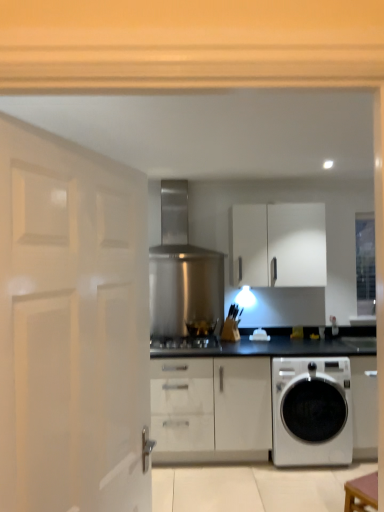
Image resolution: width=384 pixels, height=512 pixels. I want to click on white glossy washing machine at lower right, so pos(312,411).

Describe the element at coordinates (365, 263) in the screenshot. Image resolution: width=384 pixels, height=512 pixels. I see `transparent glass door at upper right` at that location.

What are the coordinates of `transparent glass door at upper right` in the screenshot? It's located at (365, 263).

This screenshot has height=512, width=384. What do you see at coordinates (361, 493) in the screenshot?
I see `brown wooden table at lower right` at bounding box center [361, 493].

Image resolution: width=384 pixels, height=512 pixels. What do you see at coordinates (176, 219) in the screenshot?
I see `stainless steel exhaust hood at center` at bounding box center [176, 219].

Locate an element on the screen. The image size is (384, 512). white glossy door at left is located at coordinates (71, 327).

In order to click on white glossy washing machine at lower right in this screenshot , I will do `click(312, 411)`.

Considering the relative sizes of white glossy door at left and brown wooden table at lower right in the image provided, is white glossy door at left thinner than brown wooden table at lower right?

Correct, the width of white glossy door at left is less than that of brown wooden table at lower right.

From a real-world perspective, between white glossy door at left and brown wooden table at lower right, who is vertically lower?

From a 3D spatial view, brown wooden table at lower right is below.

Is white glossy door at left with brown wooden table at lower right?

No, white glossy door at left is not beside brown wooden table at lower right.

Consider the image. How different are the orientations of white glossy door at left and brown wooden table at lower right in degrees?

white glossy door at left and brown wooden table at lower right are facing 48.1 degrees away from each other.

Is black glass stove at center aimed at stainless steel exhaust hood at center?

No, black glass stove at center is not turned towards stainless steel exhaust hood at center.

In the scene shown: Which is more to the right, black glass stove at center or stainless steel exhaust hood at center?

From the viewer's perspective, black glass stove at center appears more on the right side.

From a real-world perspective, is black glass stove at center physically located above or below stainless steel exhaust hood at center?

Clearly, from a real-world perspective, black glass stove at center is below stainless steel exhaust hood at center.

Looking at this image, would you say black glass stove at center is inside or outside stainless steel exhaust hood at center?

black glass stove at center lies outside stainless steel exhaust hood at center.

From their relative heights in the image, would you say satin silver gas stove at center is taller or shorter than white glossy washing machine at lower right?

Clearly, satin silver gas stove at center is shorter compared to white glossy washing machine at lower right.

Are satin silver gas stove at center and white glossy washing machine at lower right far apart?

No, satin silver gas stove at center is not far away from white glossy washing machine at lower right.

From the image's perspective, between satin silver gas stove at center and white glossy washing machine at lower right, which one is located above?

satin silver gas stove at center, from the image's perspective.

Which object is closer to the camera taking this photo, stainless steel exhaust hood at center or satin silver gas stove at center?

satin silver gas stove at center is more forward.

How many degrees apart are the facing directions of stainless steel exhaust hood at center and satin silver gas stove at center?

There is a 0.0435-degree angle between the facing directions of stainless steel exhaust hood at center and satin silver gas stove at center.

Between point (166, 196) and point (207, 345), which one is positioned behind?

The point (166, 196) is more distant.

Does stainless steel exhaust hood at center turn towards satin silver gas stove at center?

No, stainless steel exhaust hood at center is not facing towards satin silver gas stove at center.

Are white glossy washing machine at lower right and white matte cabinet at upper center located far from each other?

Indeed, white glossy washing machine at lower right is not near white matte cabinet at upper center.

Between white glossy washing machine at lower right and white matte cabinet at upper center, which one has larger size?

Bigger between the two is white glossy washing machine at lower right.

Is point (318, 390) positioned before point (299, 246)?

No.

Who is shorter, white glossy washing machine at lower right or white matte cabinet at upper center?

Standing shorter between the two is white matte cabinet at upper center.

From a real-world perspective, does transparent glass door at upper right sit lower than white matte cabinet at upper center?

Indeed, from a real-world perspective, transparent glass door at upper right is positioned beneath white matte cabinet at upper center.

The image size is (384, 512). I want to click on glass door on the right of white matte cabinet at upper center, so click(x=365, y=263).

Is transparent glass door at upper right facing away from white matte cabinet at upper center?

Answer: transparent glass door at upper right is not turned away from white matte cabinet at upper center.

Is stainless steel exhaust hood at center situated inside white glossy washing machine at lower right or outside?

stainless steel exhaust hood at center is spatially situated outside white glossy washing machine at lower right.

From a real-world perspective, is stainless steel exhaust hood at center on white glossy washing machine at lower right?

Yes, from a real-world perspective, stainless steel exhaust hood at center is on top of white glossy washing machine at lower right.

Looking at this image, does stainless steel exhaust hood at center have a lesser height compared to white glossy washing machine at lower right?

Indeed, stainless steel exhaust hood at center has a lesser height compared to white glossy washing machine at lower right.

Which of these two, stainless steel exhaust hood at center or white glossy washing machine at lower right, is bigger?

white glossy washing machine at lower right is bigger.

Where is `door that is in front of the brown wooden table at lower right`? This screenshot has width=384, height=512. door that is in front of the brown wooden table at lower right is located at coordinates (71, 327).

This screenshot has height=512, width=384. Identify the location of appliance lying below the stainless steel exhaust hood at center (from the image's perspective). (201, 327).

From the image, which object appears to be farther from brown wooden table at lower right, white glossy washing machine at lower right or stainless steel exhaust hood at center?

stainless steel exhaust hood at center.

Looking at the image, which one is located further to black glass stove at center, white glossy washing machine at lower right or white matte cabinet at upper center?

white glossy washing machine at lower right.

Considering their positions, is white glossy door at left positioned closer to satin silver gas stove at center than brown wooden table at lower right?

brown wooden table at lower right lies closer to satin silver gas stove at center than the other object.

Looking at the image, which one is located closer to white glossy washing machine at lower right, white matte cabinet at upper center or brown wooden table at lower right?

Among the two, brown wooden table at lower right is located nearer to white glossy washing machine at lower right.

Based on their spatial positions, is white matte cabinet at upper center or stainless steel exhaust hood at center closer to satin silver gas stove at center?

white matte cabinet at upper center is closer to satin silver gas stove at center.

Looking at the image, which one is located closer to brown wooden table at lower right, white matte cabinet at upper center or white glossy washing machine at lower right?

white glossy washing machine at lower right lies closer to brown wooden table at lower right than the other object.

From the image, which object appears to be farther from white matte cabinet at upper center, satin silver gas stove at center or white glossy washing machine at lower right?

white glossy washing machine at lower right is positioned further to the anchor white matte cabinet at upper center.

Based on their spatial positions, is brown wooden table at lower right or transparent glass door at upper right closer to white glossy door at left?

Among the two, brown wooden table at lower right is located nearer to white glossy door at left.

Image resolution: width=384 pixels, height=512 pixels. Find the location of `cabinetry located between white glossy door at left and transparent glass door at upper right in the depth direction`. cabinetry located between white glossy door at left and transparent glass door at upper right in the depth direction is located at coordinates (278, 245).

The image size is (384, 512). I want to click on exhaust hood between white glossy door at left and black glass stove at center in the front-back direction, so [x=176, y=219].

Identify the location of cabinetry between stainless steel exhaust hood at center and black glass stove at center in the up-down direction. Image resolution: width=384 pixels, height=512 pixels. (278, 245).

This screenshot has height=512, width=384. Identify the location of appliance between white glossy door at left and transparent glass door at upper right along the z-axis. (201, 327).